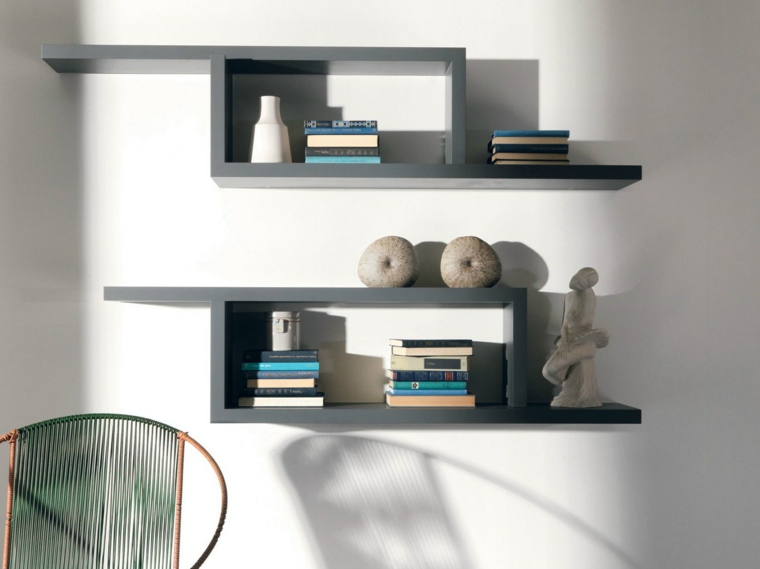
Where is `book in right stack top shelf`? book in right stack top shelf is located at coordinates (510, 163), (520, 156), (536, 149), (549, 140), (556, 133).